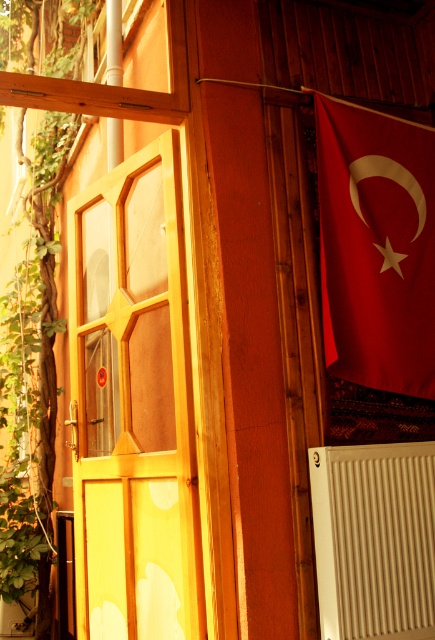
You are a delivery person approaching the building and need to place a package near the red matte flag at upper right and the white ribbed radiator at lower right. Since you can only place it in one spot, which object should you choose to ensure the package is closer to the door?

You should place the package near the white ribbed radiator at lower right because the red matte flag at upper right is to the right of the white ribbed radiator at lower right, meaning the radiator is closer to the door.

You are standing in front of the building shown in the image. The wooden door at left has a sticker near its center. If you want to reach the sticker, which direction should you face relative to the door?

You should face the center of the wooden door at left to reach the sticker located near its center.

You are a delivery person approaching the building and need to reach the wooden door at left. There is a red matte flag at upper right nearby. Which direction should you move relative to the flag to reach the door?

The wooden door at left is to the left of the red matte flag at upper right, so you should move to the left relative to the flag to reach the door.